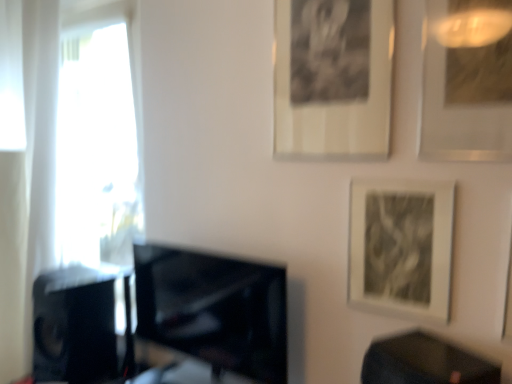
Question: From a real-world perspective, does matte black picture frame at lower right, which is the second picture frame from left to right, stand above black glossy table at lower right?

Choices:
 (A) no
 (B) yes

Answer: (B)

Question: Does matte black picture frame at lower right, positioned as the second picture frame in right-to-left order, have a lesser height compared to black glossy table at lower right?

Choices:
 (A) yes
 (B) no

Answer: (B)

Question: Is black glossy table at lower right at the back of matte black picture frame at lower right, positioned as the second picture frame in right-to-left order?

Choices:
 (A) no
 (B) yes

Answer: (A)

Question: Does matte black picture frame at lower right, which is the second picture frame from left to right, have a greater height compared to black glossy table at lower right?

Choices:
 (A) no
 (B) yes

Answer: (B)

Question: Is the position of matte black picture frame at lower right, which is the second picture frame from left to right, less distant than that of black glossy table at lower right?

Choices:
 (A) yes
 (B) no

Answer: (B)

Question: Would you say matte black picture frame at lower right, positioned as the second picture frame in right-to-left order, is inside or outside black matte picture frame at upper center, acting as the 3th picture frame starting from the right?

Choices:
 (A) inside
 (B) outside

Answer: (B)

Question: Relative to black matte picture frame at upper center, positioned as the first picture frame in left-to-right order, is matte black picture frame at lower right, which is the second picture frame from left to right, in front or behind?

Choices:
 (A) front
 (B) behind

Answer: (A)

Question: From a real-world perspective, relative to black matte picture frame at upper center, acting as the 3th picture frame starting from the right, is matte black picture frame at lower right, positioned as the second picture frame in right-to-left order, vertically above or below?

Choices:
 (A) below
 (B) above

Answer: (A)

Question: From their relative heights in the image, would you say matte black picture frame at lower right, which is the second picture frame from left to right, is taller or shorter than black matte picture frame at upper center, acting as the 3th picture frame starting from the right?

Choices:
 (A) short
 (B) tall

Answer: (A)

Question: Is black matte picture frame at upper center, positioned as the first picture frame in left-to-right order, inside or outside of matte black picture frame at lower right, positioned as the second picture frame in right-to-left order?

Choices:
 (A) inside
 (B) outside

Answer: (B)

Question: In the image, is black matte picture frame at upper center, acting as the 3th picture frame starting from the right, positioned in front of or behind matte black picture frame at lower right, positioned as the second picture frame in right-to-left order?

Choices:
 (A) front
 (B) behind

Answer: (B)

Question: Considering the positions of point [327, 26] and point [433, 279], is point [327, 26] closer or farther from the camera than point [433, 279]?

Choices:
 (A) farther
 (B) closer

Answer: (A)

Question: Considering the positions of black matte picture frame at upper center, acting as the 3th picture frame starting from the right, and matte black picture frame at lower right, positioned as the second picture frame in right-to-left order, in the image, is black matte picture frame at upper center, acting as the 3th picture frame starting from the right, bigger or smaller than matte black picture frame at lower right, positioned as the second picture frame in right-to-left order,?

Choices:
 (A) small
 (B) big

Answer: (B)

Question: From a real-world perspective, is black matte picture frame at upper center, positioned as the first picture frame in left-to-right order, positioned above or below metallic silver picture frame at upper right, which is the 1th picture frame in right-to-left order?

Choices:
 (A) above
 (B) below

Answer: (A)

Question: Looking at their shapes, would you say black matte picture frame at upper center, acting as the 3th picture frame starting from the right, is wider or thinner than metallic silver picture frame at upper right, positioned as the third picture frame in left-to-right order?

Choices:
 (A) thin
 (B) wide

Answer: (A)